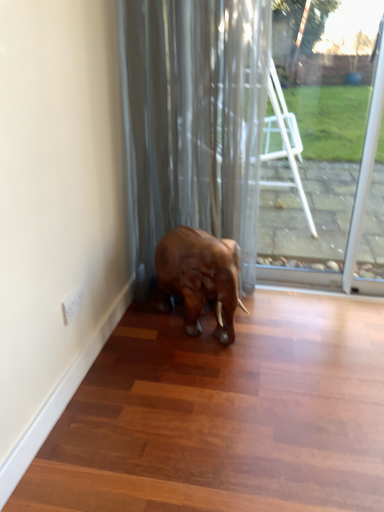
Question: Is transparent glass door at center located within satin gray curtain at center?

Choices:
 (A) yes
 (B) no

Answer: (B)

Question: Is satin gray curtain at center aimed at transparent glass door at center?

Choices:
 (A) no
 (B) yes

Answer: (A)

Question: From a real-world perspective, is satin gray curtain at center positioned over transparent glass door at center based on gravity?

Choices:
 (A) yes
 (B) no

Answer: (A)

Question: Does satin gray curtain at center have a smaller size compared to transparent glass door at center?

Choices:
 (A) no
 (B) yes

Answer: (A)

Question: Can you confirm if satin gray curtain at center is shorter than transparent glass door at center?

Choices:
 (A) no
 (B) yes

Answer: (A)

Question: Considering the positions of transparent glass door at center and satin gray curtain at center in the image, is transparent glass door at center wider or thinner than satin gray curtain at center?

Choices:
 (A) thin
 (B) wide

Answer: (A)

Question: Is point (279, 223) positioned closer to the camera than point (201, 54)?

Choices:
 (A) farther
 (B) closer

Answer: (A)

Question: Considering the positions of transparent glass door at center and satin gray curtain at center in the image, is transparent glass door at center bigger or smaller than satin gray curtain at center?

Choices:
 (A) big
 (B) small

Answer: (B)

Question: From the image's perspective, is transparent glass door at center above or below satin gray curtain at center?

Choices:
 (A) above
 (B) below

Answer: (B)

Question: Is point (196, 292) closer or farther from the camera than point (236, 137)?

Choices:
 (A) farther
 (B) closer

Answer: (B)

Question: From a real-world perspective, is shiny brown elephant at center above or below satin gray curtain at center?

Choices:
 (A) above
 (B) below

Answer: (B)

Question: In the image, is shiny brown elephant at center on the left side or the right side of satin gray curtain at center?

Choices:
 (A) left
 (B) right

Answer: (B)

Question: Do you think shiny brown elephant at center is within satin gray curtain at center, or outside of it?

Choices:
 (A) inside
 (B) outside

Answer: (A)

Question: In terms of width, does shiny brown elephant at center look wider or thinner when compared to transparent glass door at center?

Choices:
 (A) thin
 (B) wide

Answer: (B)

Question: Which is correct: shiny brown elephant at center is inside transparent glass door at center, or outside of it?

Choices:
 (A) outside
 (B) inside

Answer: (A)